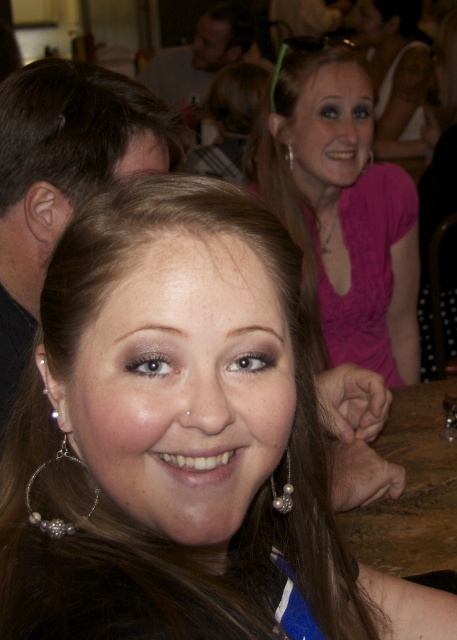
From the picture: Which of these two, pink satin blouse at upper center or dark brown hair at upper left, stands shorter?

dark brown hair at upper left

Does pink satin blouse at upper center appear over dark brown hair at upper left?

Incorrect, pink satin blouse at upper center is not positioned above dark brown hair at upper left.

Identify the location of pink satin blouse at upper center. (340, 212).

Who is more distant from viewer, (99, 628) or (271, 476)?

Point (271, 476)

Locate an element on the screen. brownsmoothhair at center is located at coordinates (120, 506).

Who is positioned more to the left, shiny silver hoop earrings at center or pearl/textured earring at lower center?

From the viewer's perspective, shiny silver hoop earrings at center appears more on the left side.

Is shiny silver hoop earrings at center smaller than pearl/textured earring at lower center?

Incorrect, shiny silver hoop earrings at center is not smaller in size than pearl/textured earring at lower center.

This screenshot has width=457, height=640. I want to click on shiny silver hoop earrings at center, so click(x=62, y=176).

Identify the location of shiny silver hoop earrings at center. The height and width of the screenshot is (640, 457). (62, 176).